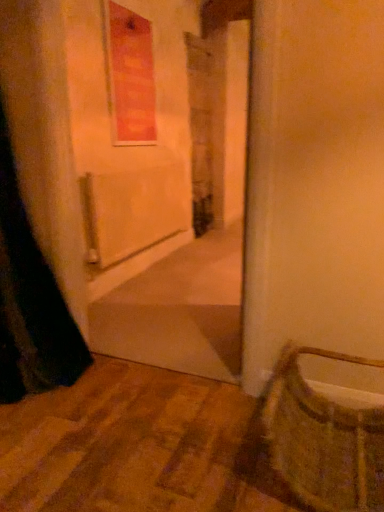
Find the location of a particular element. This screenshot has width=384, height=512. empty space that is ontop of matte orange window at upper center (from a real-world perspective) is located at coordinates (131, 8).